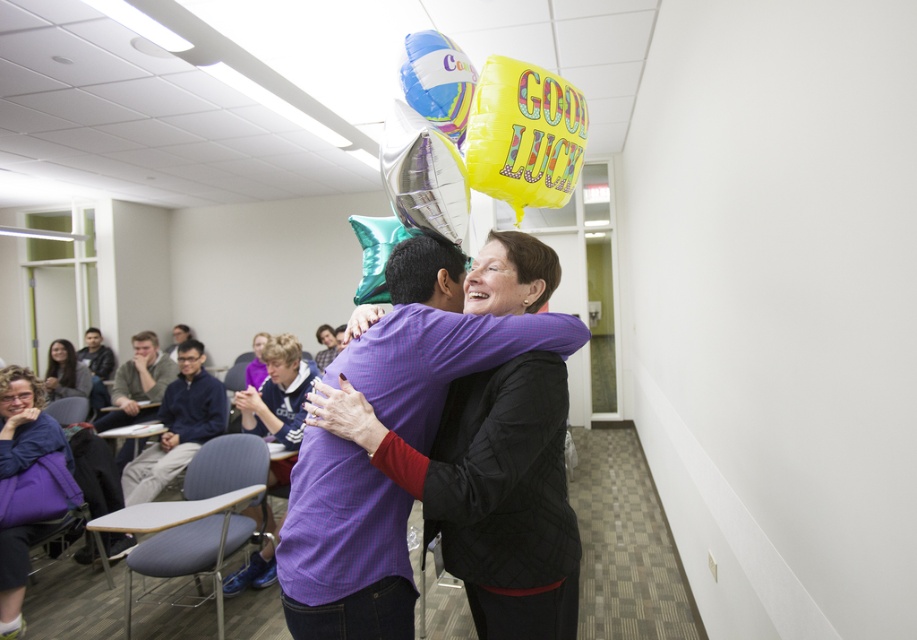
You are a photographer taking a picture of the two people hugging in the scene. You notice the yellow metallic balloon at upper center and the blonde hair at upper center. Which object is positioned higher in the frame?

The yellow metallic balloon at upper center is taller than the blonde hair at upper center, so the yellow metallic balloon at upper center is positioned higher in the frame.

You are organizing a surprise party and need to decide where to place decorations. The purple matte shirt at center and the matte black hair at upper center are in the way. Which object is narrower so you can place decorations around it more easily?

The purple matte shirt at center is narrower than the matte black hair at upper center, so you can place decorations around it more easily.